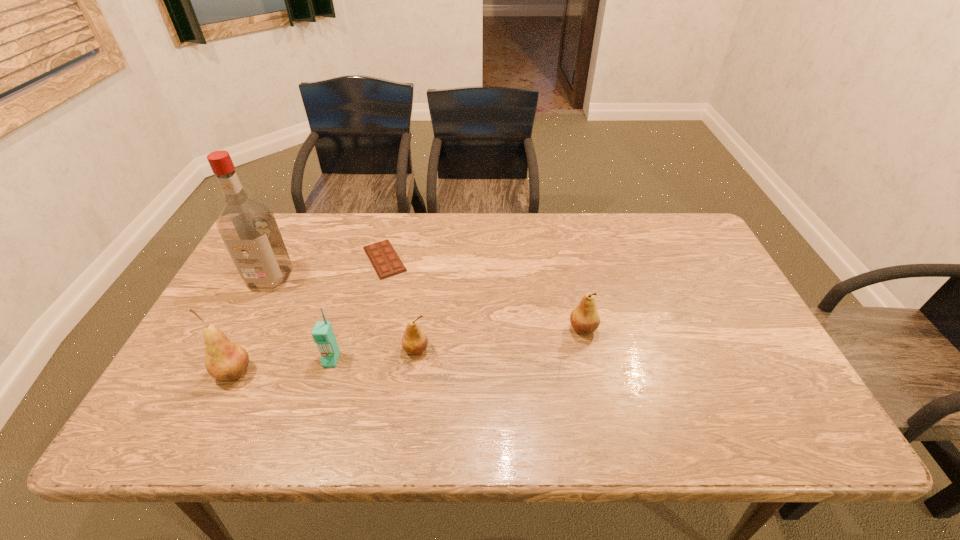
At what (x,y) coordinates should I click in order to perform the action: click on vacant space located on the back of the rightmost pear. Please return your answer as a coordinate pair (x, y). Image resolution: width=960 pixels, height=540 pixels. Looking at the image, I should click on (564, 241).

Locate an element on the screen. free space located on the right of the chocolate bar is located at coordinates (501, 259).

Identify the location of free space located on the front-facing side of the tallest object. (245, 327).

You are a GUI agent. You are given a task and a screenshot of the screen. Output one action in this format:
    pyautogui.click(x=<x>, y=<y>)
    Task: Click on the vacant area situated on the keypad of the cellular telephone
    The image size is (960, 540).
    Given the screenshot: What is the action you would take?
    pyautogui.click(x=320, y=397)

Identify the location of object located in the far edge section of the desktop. (386, 262).

This screenshot has width=960, height=540. What are the coordinates of `object that is at the near edge` in the screenshot? It's located at (224, 360).

At what (x,y) coordinates should I click in order to perform the action: click on pear that is at the left edge. Please return your answer as a coordinate pair (x, y). The width and height of the screenshot is (960, 540). Looking at the image, I should click on (224, 360).

Identify the location of liquor that is at the left edge. (248, 228).

At what (x,y) coordinates should I click in order to perform the action: click on object that is at the near left corner. Please return your answer as a coordinate pair (x, y). Looking at the image, I should click on (224, 360).

In the image, there is a desktop. Identify the location of vacant space at the far edge. The height and width of the screenshot is (540, 960). (455, 245).